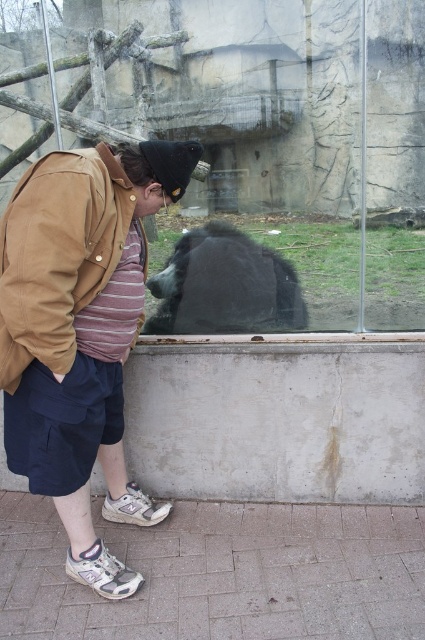
You are a zookeeper trying to locate the brown cotton jacket at center in the image. According to the coordinates provided, where would you find it in the image?

The brown cotton jacket at center is located at the 2D coordinates point (81, 332) in the image.

You are a zookeeper who needs to determine the visibility of the brown cotton jacket at center from the black fur bear at center. Based on the scene, can the bear see the jacket?

The brown cotton jacket at center is in front of the black fur bear at center, so the bear cannot see the jacket because it is blocked by the barrier between them.